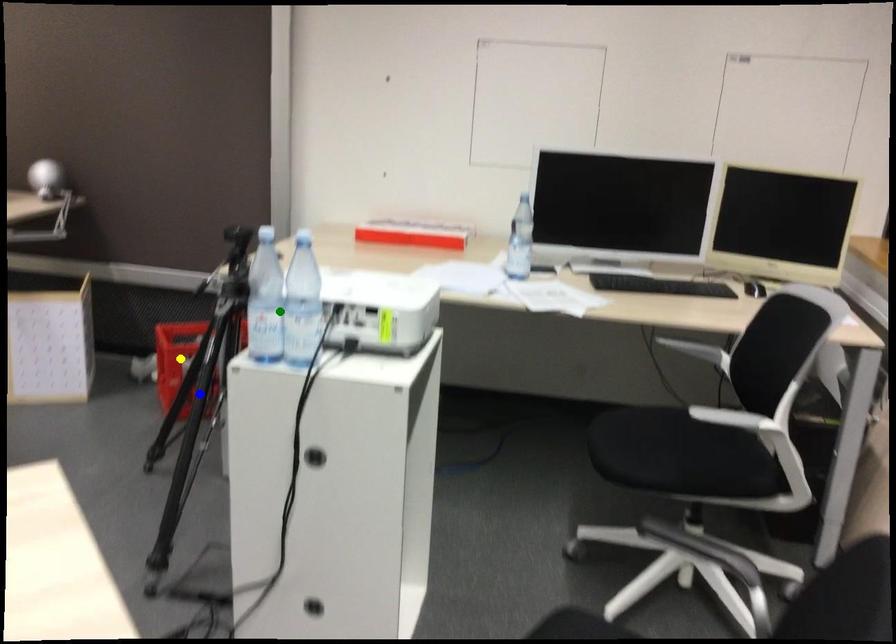
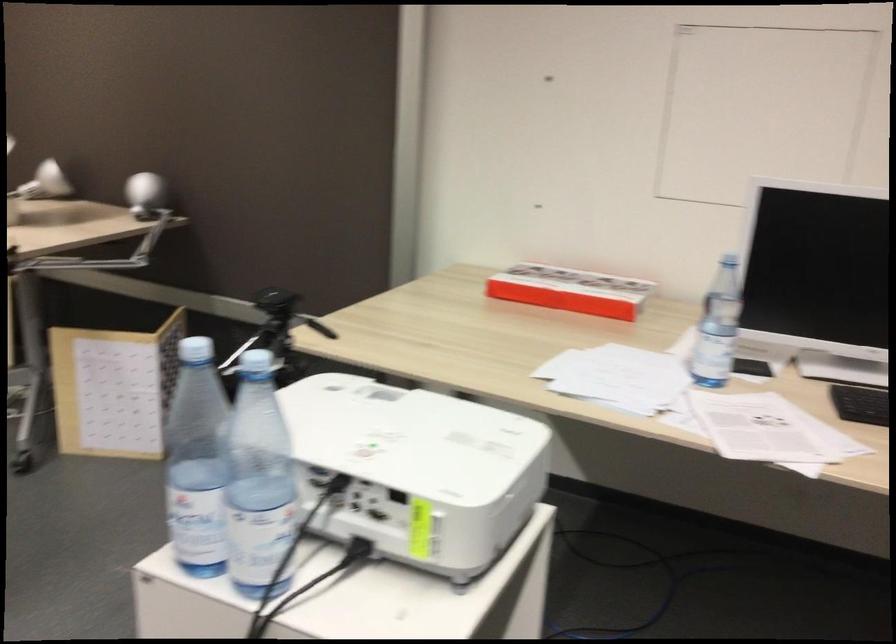
I am providing you with two images of the same scene from different viewpoints. Three points are marked in image1. Which point corresponds to a part or object that is occluded in image2?In image1, three points are marked. Which of them correspond to a part or object that is occluded in image2?Among the three points shown in image1, which one corresponds to a part or object that is no longer visible due to occlusion in image2?

Invisible in image2: yellow point, blue point.